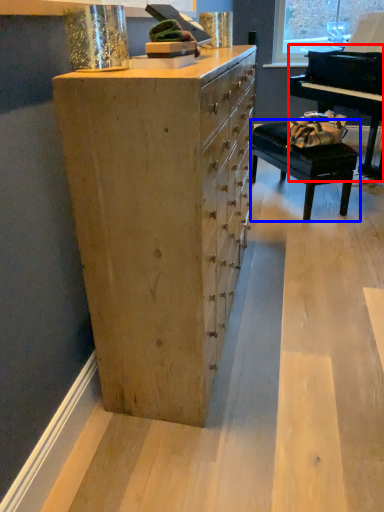
Question: Which point is closer to the camera, piano (highlighted by a red box) or table (highlighted by a blue box)?

Choices:
 (A) piano
 (B) table

Answer: (A)